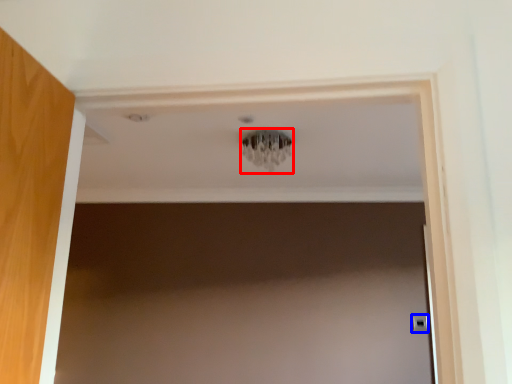
Question: Which of the following is the farthest to the observer, light fixture (highlighted by a red box) or door handle (highlighted by a blue box)?

Choices:
 (A) light fixture
 (B) door handle

Answer: (B)